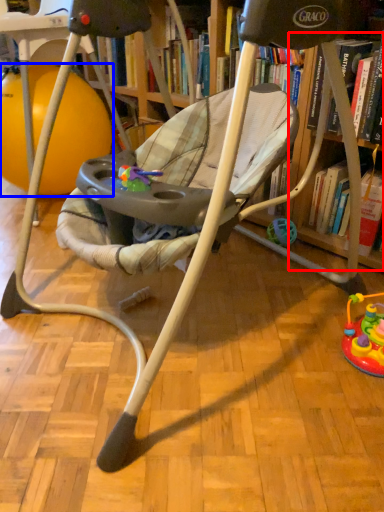
Question: Which of the following is the farthest to the observer, shelf (highlighted by a red box) or ball (highlighted by a blue box)?

Choices:
 (A) shelf
 (B) ball

Answer: (B)